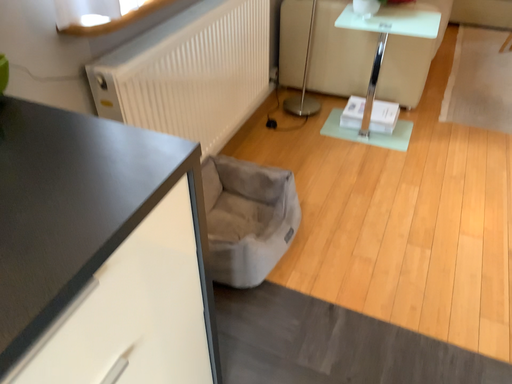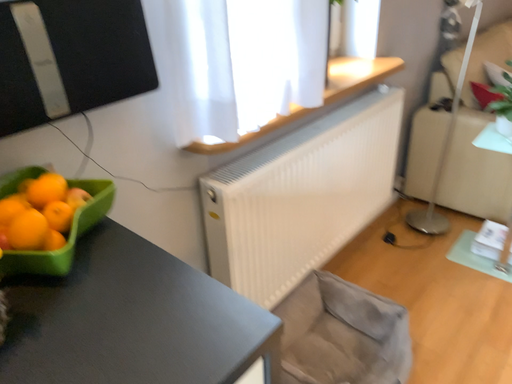
Question: How did the camera likely rotate when shooting the video?

Choices:
 (A) rotated right
 (B) rotated left

Answer: (B)